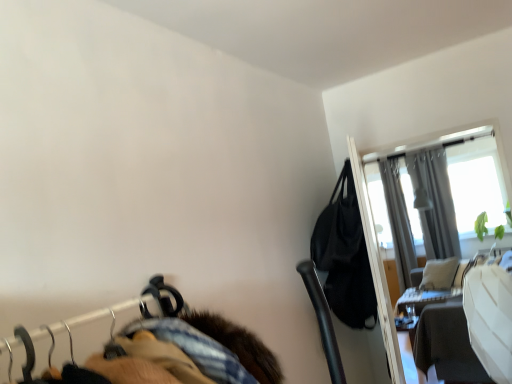
Question: Is black leather bag at upper right positioned far away from wooden table at right?

Choices:
 (A) yes
 (B) no

Answer: (A)

Question: Is wooden table at right at the back of black leather bag at upper right?

Choices:
 (A) no
 (B) yes

Answer: (B)

Question: Is black leather bag at upper right completely or partially outside of wooden table at right?

Choices:
 (A) no
 (B) yes

Answer: (B)

Question: Does black leather bag at upper right have a smaller size compared to wooden table at right?

Choices:
 (A) yes
 (B) no

Answer: (A)

Question: Could you tell me if black leather bag at upper right is turned towards wooden table at right?

Choices:
 (A) no
 (B) yes

Answer: (A)

Question: Considering the relative sizes of black leather bag at upper right and wooden table at right in the image provided, is black leather bag at upper right bigger than wooden table at right?

Choices:
 (A) no
 (B) yes

Answer: (A)

Question: From a real-world perspective, does gray fabric curtain at upper right, the 2th curtain positioned from the left, sit lower than transparent glass screen door at upper right?

Choices:
 (A) no
 (B) yes

Answer: (A)

Question: Is gray fabric curtain at upper right, the 2th curtain positioned from the left, placed right next to transparent glass screen door at upper right?

Choices:
 (A) no
 (B) yes

Answer: (A)

Question: From the image's perspective, does gray fabric curtain at upper right, arranged as the 1th curtain when viewed from the right, appear higher than transparent glass screen door at upper right?

Choices:
 (A) no
 (B) yes

Answer: (B)

Question: Can you confirm if gray fabric curtain at upper right, arranged as the 1th curtain when viewed from the right, is positioned to the left of transparent glass screen door at upper right?

Choices:
 (A) yes
 (B) no

Answer: (B)

Question: Would you say gray fabric curtain at upper right, the 2th curtain positioned from the left, contains transparent glass screen door at upper right?

Choices:
 (A) no
 (B) yes

Answer: (A)

Question: Is gray fabric curtain at upper right, arranged as the 1th curtain when viewed from the right, facing away from transparent glass screen door at upper right?

Choices:
 (A) no
 (B) yes

Answer: (A)

Question: Considering the relative sizes of black leather bag at upper right and gray fabric curtain at upper right, the 1th curtain positioned from the left, in the image provided, is black leather bag at upper right thinner than gray fabric curtain at upper right, the 1th curtain positioned from the left,?

Choices:
 (A) no
 (B) yes

Answer: (A)